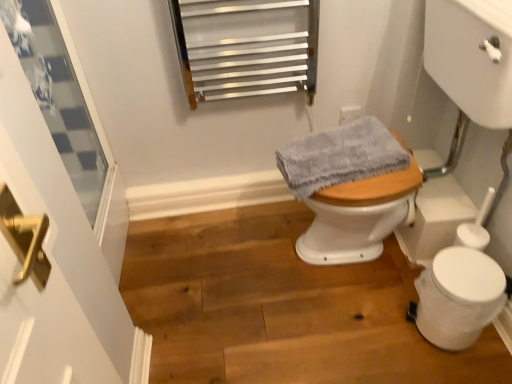
This screenshot has width=512, height=384. I want to click on free space in front of white glossy sink at right, so click(375, 342).